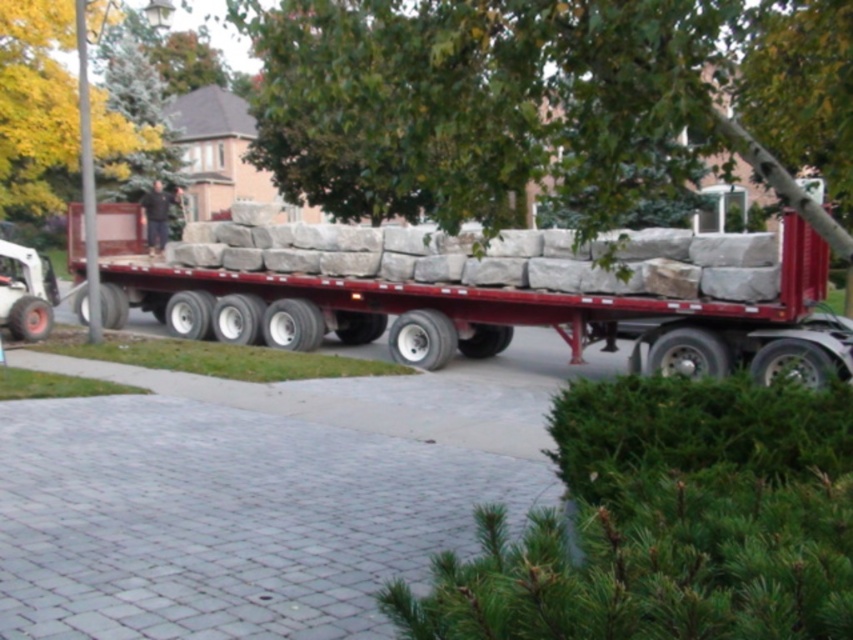
You are standing at the back of the truck and want to walk to the point labeled point (167, 195). However, there is an obstacle at point (33, 83). Can you safely walk around the obstacle to reach your destination?

Since point (33, 83) is in front of point (167, 195), you can walk around the obstacle by moving to the side of point (33, 83) to reach point (167, 195) safely.

You are a delivery driver who needs to unload the dark brown leather jacket at center from the truck. However, there is a green leafy tree at upper left blocking your path. Can you estimate if the jacket can fit through the space between the tree and the truck?

The green leafy tree at upper left is wider than the dark brown leather jacket at center, so the jacket can fit through the space between the tree and the truck as long as the width of the path is sufficient to accommodate the jacket.

You are standing at the center of the image looking towards the truck. Which direction should you turn to face the green leafy tree at upper left?

The green leafy tree at upper left is located at point (x=35, y=106), which is to the upper left direction from your current position at the center. Therefore, you should turn to your upper left to face the green leafy tree at upper left.